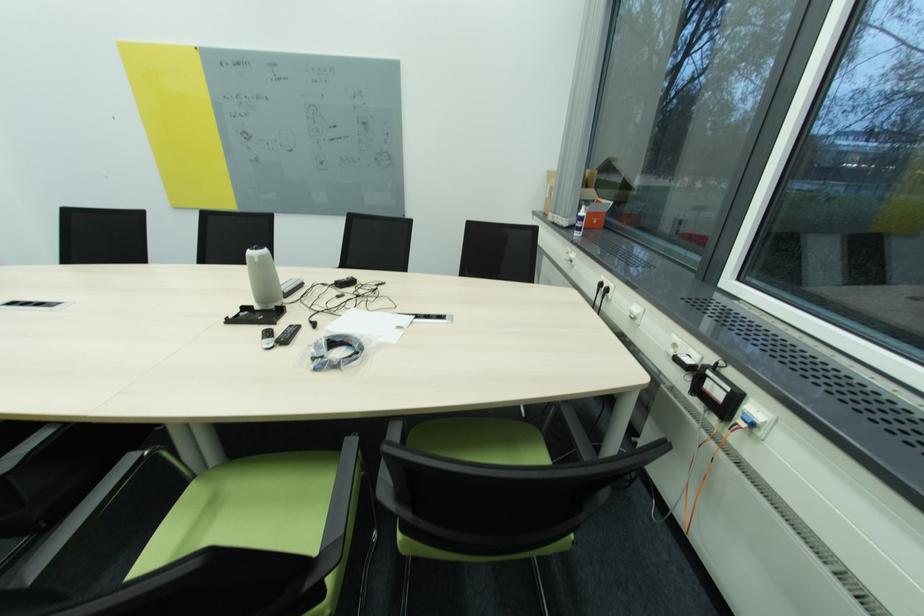
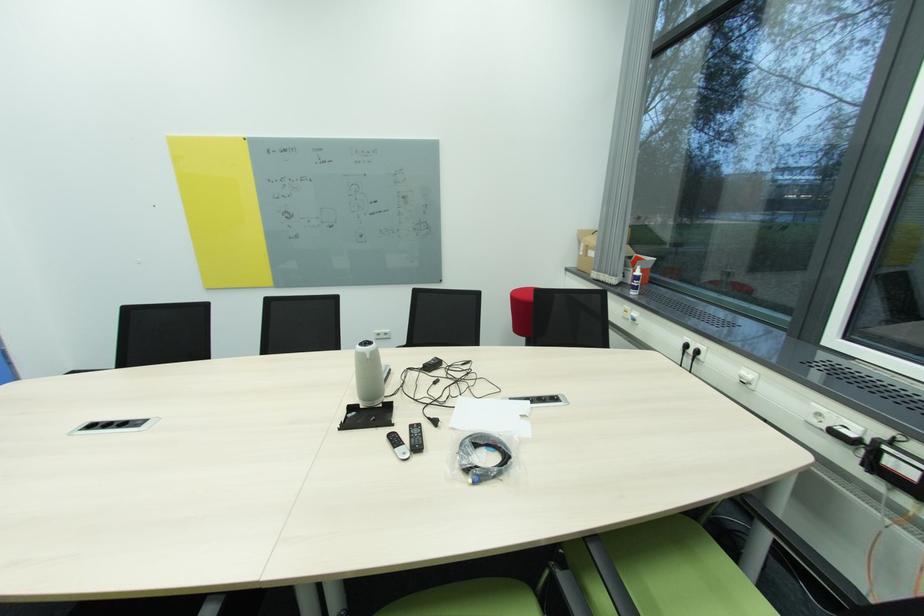
The point at (296, 328) is marked in the first image. Where is the corresponding point in the second image?

(416, 427)